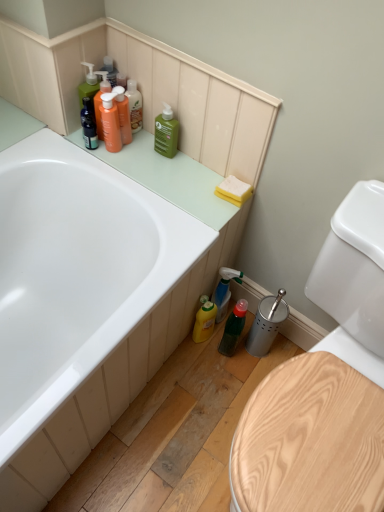
At what (x,y) coordinates should I click in order to perform the action: click on free point to the left of yellow sponge at upper right. Please return your answer as a coordinate pair (x, y). This screenshot has height=512, width=384. Looking at the image, I should click on (187, 189).